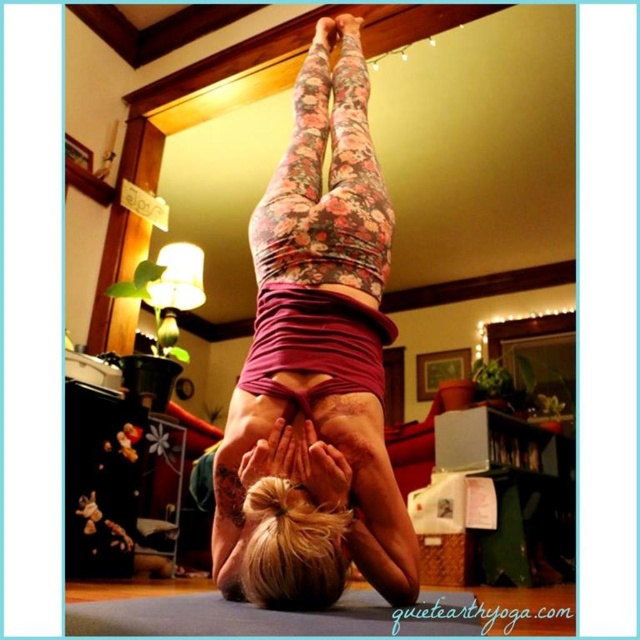
Question: Which point is closer to the camera?

Choices:
 (A) (467, 618)
 (B) (260, 248)

Answer: (A)

Question: Considering the relative positions of floral leggings at center and blue rubber yoga mat at center in the image provided, where is floral leggings at center located with respect to blue rubber yoga mat at center?

Choices:
 (A) below
 (B) above

Answer: (B)

Question: Does floral leggings at center appear on the right side of blue rubber yoga mat at center?

Choices:
 (A) yes
 (B) no

Answer: (B)

Question: Does floral leggings at center come in front of blue rubber yoga mat at center?

Choices:
 (A) yes
 (B) no

Answer: (B)

Question: Which point appears closest to the camera in this image?

Choices:
 (A) (362, 604)
 (B) (212, 484)

Answer: (A)